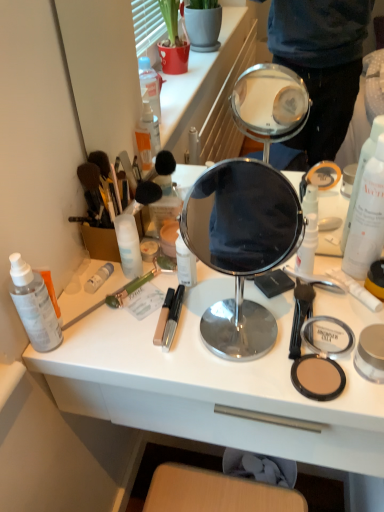
At what (x,y) coordinates should I click in order to perform the action: click on vacant space behind matte black compact at lower right. Please return your answer as a coordinate pair (x, y). This screenshot has width=384, height=512. Looking at the image, I should click on (272, 303).